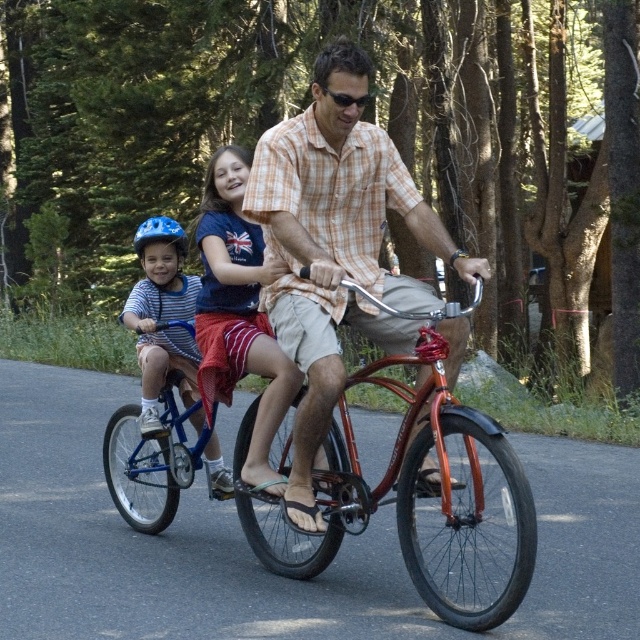
Is matte orange shirt at center positioned in front of matte blue helmet at left?

Yes, it is.

Can you confirm if matte orange shirt at center is wider than matte blue helmet at left?

Indeed, matte orange shirt at center has a greater width compared to matte blue helmet at left.

Which is in front, point (314, 371) or point (172, 228)?

Point (314, 371) is in front.

The height and width of the screenshot is (640, 640). I want to click on matte orange shirt at center, so click(337, 246).

Who is shorter, matte orange shirt at center or shiny metallic bicycle at center?

Standing shorter between the two is shiny metallic bicycle at center.

Can you confirm if matte orange shirt at center is positioned to the left of shiny metallic bicycle at center?

Indeed, matte orange shirt at center is positioned on the left side of shiny metallic bicycle at center.

Which is behind, point (305, 524) or point (484, 572)?

Point (484, 572)

Locate an element on the screen. Image resolution: width=640 pixels, height=640 pixels. matte orange shirt at center is located at coordinates (337, 246).

What do you see at coordinates (237, 314) in the screenshot?
I see `blue helmet at left` at bounding box center [237, 314].

Where is `blue helmet at left`? blue helmet at left is located at coordinates (237, 314).

Where is `blue helmet at left`? The image size is (640, 640). blue helmet at left is located at coordinates (237, 314).